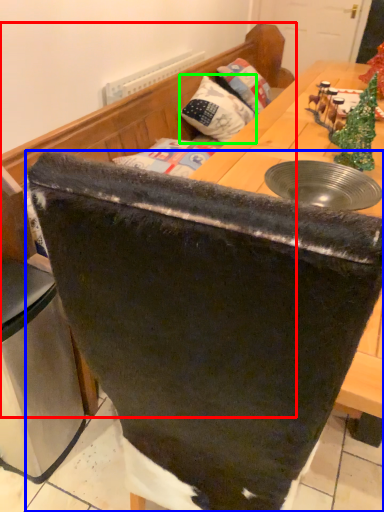
Question: Which is farther away from furniture (highlighted by a red box)? chair (highlighted by a blue box) or pillow (highlighted by a green box)?

Choices:
 (A) chair
 (B) pillow

Answer: (A)